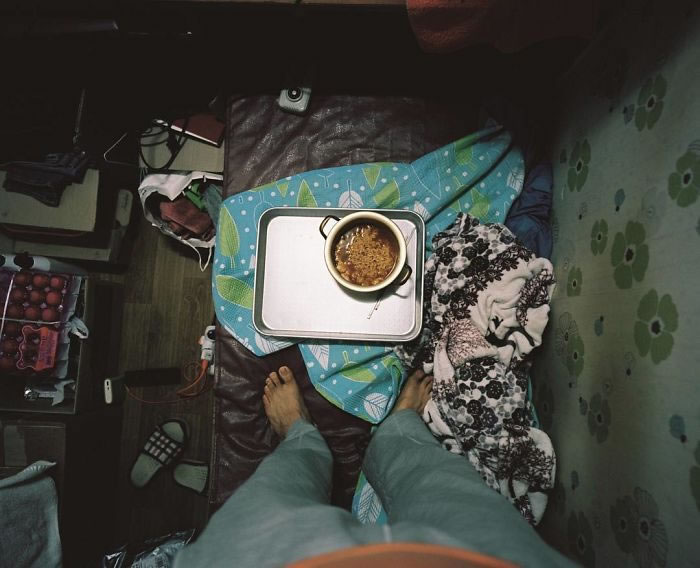
Identify the location of slippers. The image size is (700, 568). (167, 442), (195, 471).